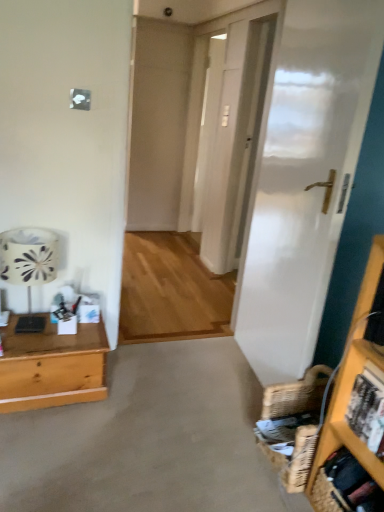
Where is `vacant space in white fabric lampshade at left (from a real-world perspective)`? This screenshot has width=384, height=512. vacant space in white fabric lampshade at left (from a real-world perspective) is located at coordinates (35, 326).